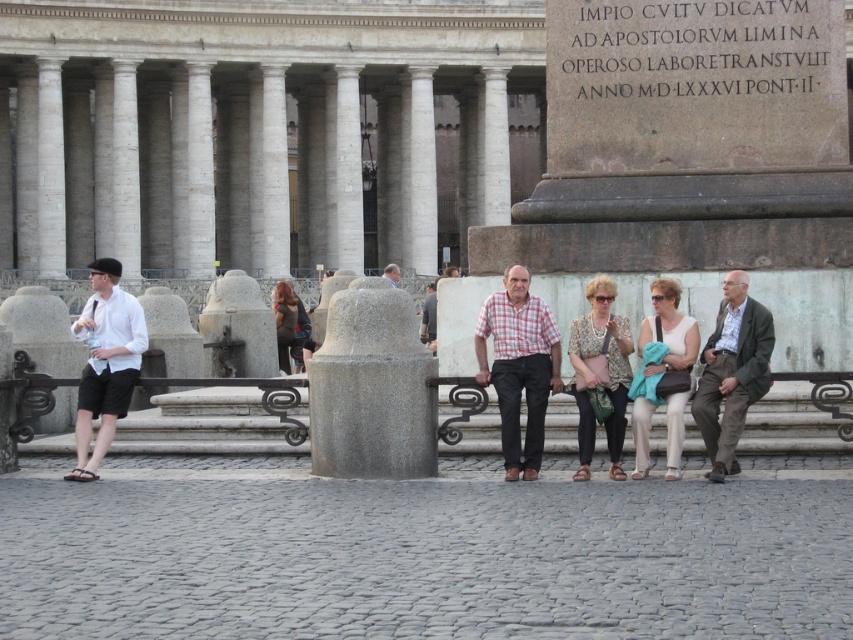
You are standing in the public square and want to locate the green textured blazer at right. According to the coordinates provided, where exactly should you look?

The green textured blazer at right is located at coordinates point (732, 372).

You are standing in the public square and see the white cotton shirt at left and the smooth gray stone statue at center. Which object is closer to the ground?

The white cotton shirt at left is positioned under the smooth gray stone statue at center, so it is closer to the ground.

What are the coordinates of the white cotton shirt at left in the image?

The white cotton shirt at left is located at coordinates point (106, 362).